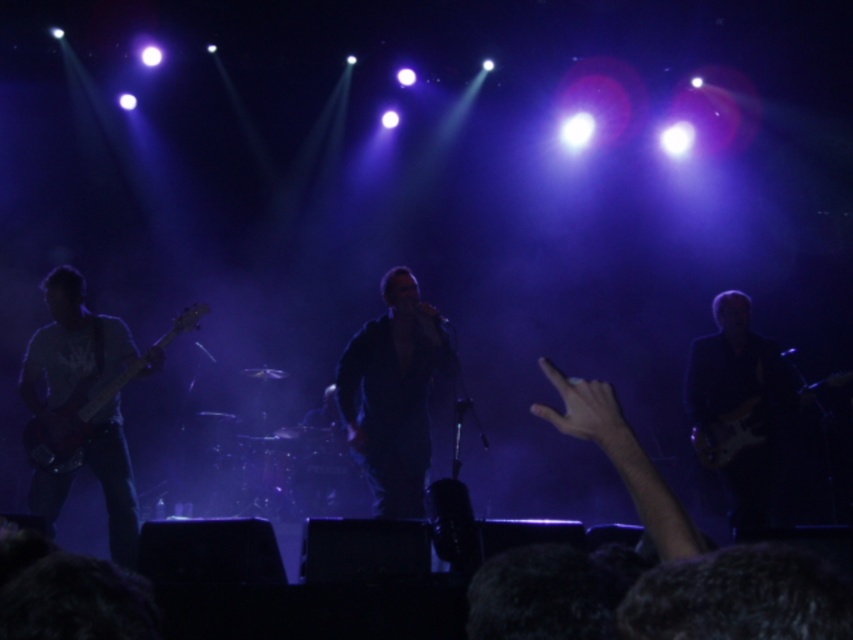
Locate an element on the screen. This screenshot has height=640, width=853. matte black guitar at left is located at coordinates (68, 426).

Is point (61, 451) farther from viewer compared to point (738, 410)?

No, it is not.

Image resolution: width=853 pixels, height=640 pixels. I want to click on matte black guitar at left, so click(x=68, y=426).

This screenshot has height=640, width=853. What do you see at coordinates (738, 406) in the screenshot? I see `black matte guitar at right` at bounding box center [738, 406].

Which of these two, black matte guitar at right or matte black guitar at left, stands shorter?

matte black guitar at left

Is point (764, 390) closer to viewer compared to point (55, 419)?

No, (764, 390) is behind (55, 419).

Find the location of a particular element. This screenshot has height=640, width=853. black matte guitar at right is located at coordinates tap(738, 406).

Between point (344, 401) and point (732, 508), which one is positioned behind?

Point (732, 508)

Identify the location of dark blue leather jacket at center. This screenshot has height=640, width=853. (393, 394).

Locate an element on the screen. dark blue leather jacket at center is located at coordinates (393, 394).